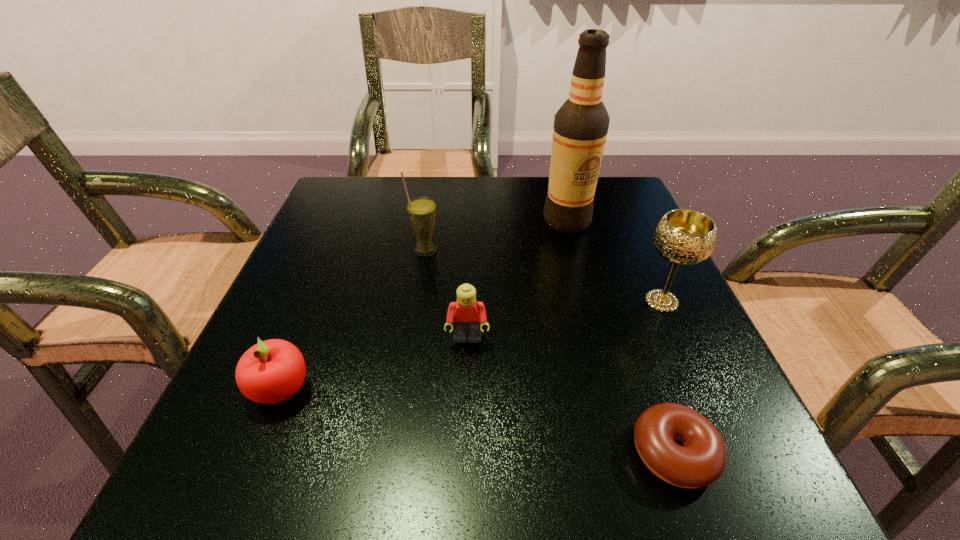
Locate an element on the screen. The image size is (960, 540). object that is the second nearest to the chalice is located at coordinates (701, 461).

The width and height of the screenshot is (960, 540). In order to click on free region that satisfies the following two spatial constraints: 1. on the back side of the chalice; 2. on the left side of the shortest object in this screenshot , I will do `click(621, 301)`.